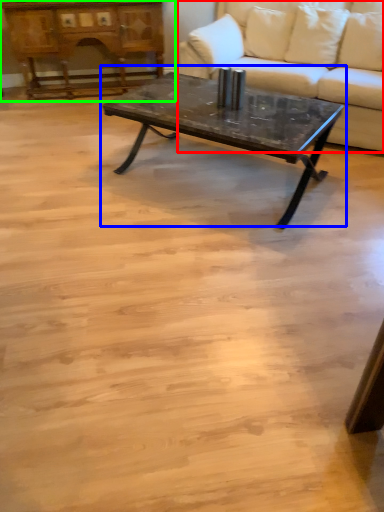
Question: Which object is positioned closest to studio couch (highlighted by a red box)? Select from coffee table (highlighted by a blue box) and dresser (highlighted by a green box).

Choices:
 (A) coffee table
 (B) dresser

Answer: (A)